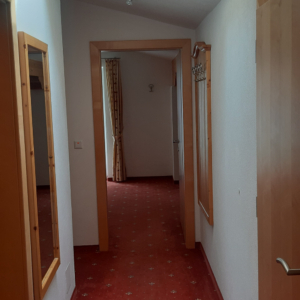
Where is `red carpet`? red carpet is located at coordinates (81, 254), (159, 283), (150, 196), (115, 191).